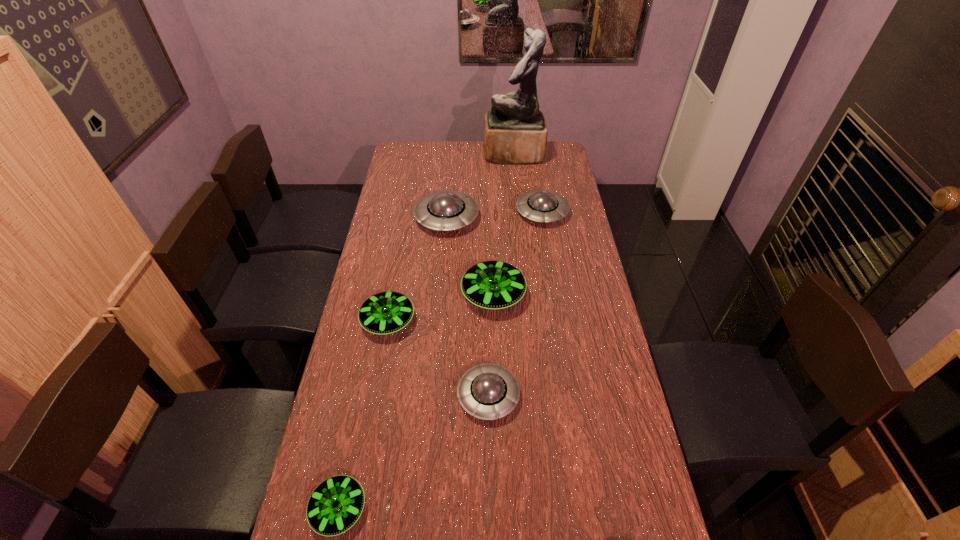
Locate an element on the screen. sculpture is located at coordinates (515, 132).

I want to click on the tallest object, so click(515, 132).

The image size is (960, 540). I want to click on the biggest gray saucer, so click(x=446, y=210).

Identify the location of the rightmost green saucer. pos(494,285).

At what (x,y) coordinates should I click in order to perform the action: click on the second smallest gray saucer. Please return your answer as a coordinate pair (x, y). This screenshot has width=960, height=540. Looking at the image, I should click on (538, 205).

This screenshot has height=540, width=960. In order to click on the second smallest green saucer in this screenshot , I will do [x=387, y=312].

Where is `the smallest gray saucer`? The height and width of the screenshot is (540, 960). the smallest gray saucer is located at coordinates (488, 391).

Locate an element on the screen. the second nearest object is located at coordinates (488, 391).

Image resolution: width=960 pixels, height=540 pixels. I want to click on free space located 0.400m in a relaxed pose on the tallest object, so click(x=403, y=153).

This screenshot has width=960, height=540. Find the location of `vacant point located 0.340m in a relaxed pose on the tallest object`. vacant point located 0.340m in a relaxed pose on the tallest object is located at coordinates (416, 153).